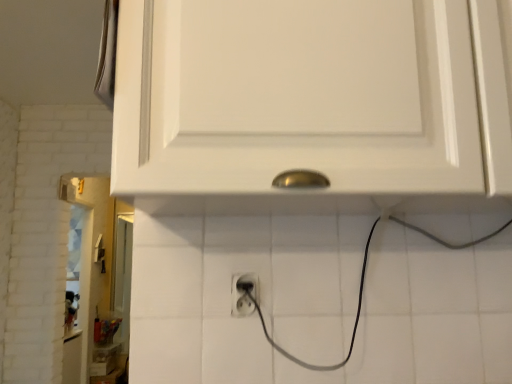
This screenshot has width=512, height=384. What do you see at coordinates (305, 95) in the screenshot? I see `white matte cabinet at upper center` at bounding box center [305, 95].

This screenshot has width=512, height=384. I want to click on white matte cabinet at upper center, so click(x=305, y=95).

What is the approximate width of white matte cabinet at upper center?

white matte cabinet at upper center is 34.00 centimeters wide.

The height and width of the screenshot is (384, 512). Identify the location of black plastic power plugs and sockets at center. (244, 294).

The height and width of the screenshot is (384, 512). Describe the element at coordinates (244, 294) in the screenshot. I see `black plastic power plugs and sockets at center` at that location.

Where is `white matte cabinet at upper center`? white matte cabinet at upper center is located at coordinates (305, 95).

Is white matte cabinet at upper center to the left or to the right of black plastic power plugs and sockets at center in the image?

Based on their positions, white matte cabinet at upper center is located to the right of black plastic power plugs and sockets at center.

In the scene shown: Is the depth of white matte cabinet at upper center less than that of black plastic power plugs and sockets at center?

Yes, it is.

Considering the positions of point (242, 137) and point (239, 300), is point (242, 137) closer or farther from the camera than point (239, 300)?

Clearly, point (242, 137) is closer to the camera than point (239, 300).

From the image's perspective, relative to black plastic power plugs and sockets at center, is white matte cabinet at upper center above or below?

white matte cabinet at upper center is above black plastic power plugs and sockets at center.

From a real-world perspective, is white matte cabinet at upper center physically located above or below black plastic power plugs and sockets at center?

Clearly, from a real-world perspective, white matte cabinet at upper center is above black plastic power plugs and sockets at center.

Can you confirm if white matte cabinet at upper center is wider than black plastic power plugs and sockets at center?

Correct, the width of white matte cabinet at upper center exceeds that of black plastic power plugs and sockets at center.

Does white matte cabinet at upper center have a lesser height compared to black plastic power plugs and sockets at center?

In fact, white matte cabinet at upper center may be taller than black plastic power plugs and sockets at center.

Is white matte cabinet at upper center bigger than black plastic power plugs and sockets at center?

Yes, white matte cabinet at upper center is bigger than black plastic power plugs and sockets at center.

Is white matte cabinet at upper center inside the boundaries of black plastic power plugs and sockets at center, or outside?

white matte cabinet at upper center lies outside black plastic power plugs and sockets at center.

Are white matte cabinet at upper center and black plastic power plugs and sockets at center making contact?

There is a gap between white matte cabinet at upper center and black plastic power plugs and sockets at center.

Is white matte cabinet at upper center facing away from black plastic power plugs and sockets at center?

That's not correct — white matte cabinet at upper center is not looking away from black plastic power plugs and sockets at center.

Measure the distance between white matte cabinet at upper center and black plastic power plugs and sockets at center.

A distance of 18.32 inches exists between white matte cabinet at upper center and black plastic power plugs and sockets at center.

I want to click on cabinetry that appears above the black plastic power plugs and sockets at center (from the image's perspective), so click(x=305, y=95).

Would you say black plastic power plugs and sockets at center is to the left or to the right of white matte cabinet at upper center in the picture?

In the image, black plastic power plugs and sockets at center appears on the left side of white matte cabinet at upper center.

Considering their positions, is black plastic power plugs and sockets at center located in front of or behind white matte cabinet at upper center?

Clearly, black plastic power plugs and sockets at center is behind white matte cabinet at upper center.

Is point (237, 310) closer or farther from the camera than point (489, 121)?

Point (237, 310) is positioned farther from the camera compared to point (489, 121).

From the image's perspective, does black plastic power plugs and sockets at center appear lower than white matte cabinet at upper center?

Yes.

From a real-world perspective, which object rests below the other?

In real-world perspective, black plastic power plugs and sockets at center is lower.

Does black plastic power plugs and sockets at center have a greater width compared to white matte cabinet at upper center?

No, black plastic power plugs and sockets at center is not wider than white matte cabinet at upper center.

Can you confirm if black plastic power plugs and sockets at center is shorter than white matte cabinet at upper center?

Indeed, black plastic power plugs and sockets at center has a lesser height compared to white matte cabinet at upper center.

Considering the relative sizes of black plastic power plugs and sockets at center and white matte cabinet at upper center in the image provided, is black plastic power plugs and sockets at center bigger than white matte cabinet at upper center?

Actually, black plastic power plugs and sockets at center might be smaller than white matte cabinet at upper center.

Is black plastic power plugs and sockets at center located outside white matte cabinet at upper center?

That's correct, black plastic power plugs and sockets at center is outside of white matte cabinet at upper center.

Are black plastic power plugs and sockets at center and white matte cabinet at upper center far apart?

black plastic power plugs and sockets at center is near white matte cabinet at upper center, not far away.

Looking at this image, is black plastic power plugs and sockets at center looking in the opposite direction of white matte cabinet at upper center?

black plastic power plugs and sockets at center is not turned away from white matte cabinet at upper center.

Measure the distance from black plastic power plugs and sockets at center to white matte cabinet at upper center.

black plastic power plugs and sockets at center and white matte cabinet at upper center are 18.32 inches apart from each other.

Where is `cabinetry above the black plastic power plugs and sockets at center (from the image's perspective)`? Image resolution: width=512 pixels, height=384 pixels. cabinetry above the black plastic power plugs and sockets at center (from the image's perspective) is located at coordinates click(x=305, y=95).

Where is `cabinetry on the right side of black plastic power plugs and sockets at center`? This screenshot has height=384, width=512. cabinetry on the right side of black plastic power plugs and sockets at center is located at coordinates (305, 95).

Locate an element on the screen. cabinetry lying in front of the black plastic power plugs and sockets at center is located at coordinates (305, 95).